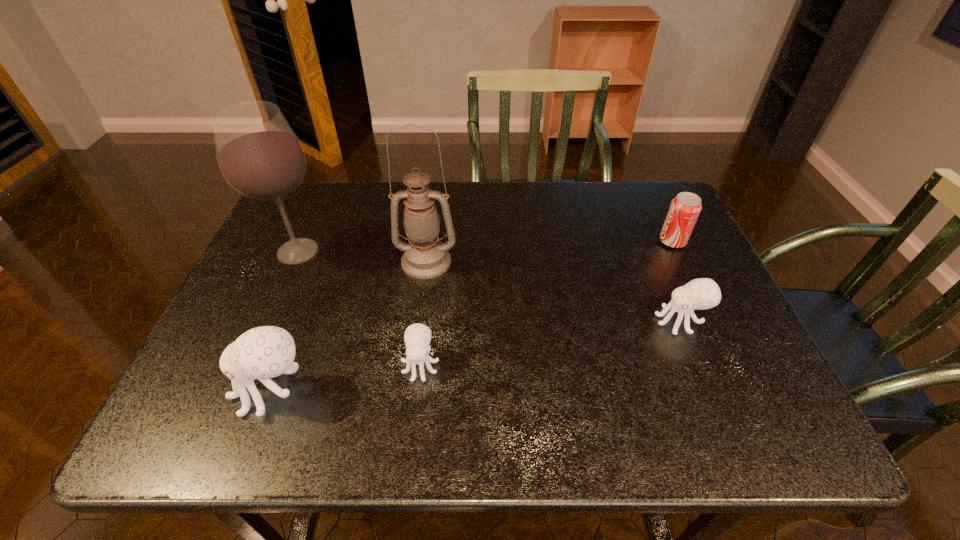
You are a GUI agent. You are given a task and a screenshot of the screen. Output one action in this format:
    pyautogui.click(x=<x>, y=<y>)
    Task: Click on the free space located on the front-facing side of the tallest octopus
    Image resolution: width=960 pixels, height=540 pixels.
    Given the screenshot: What is the action you would take?
    pyautogui.click(x=208, y=390)

Locate an element on the screen. The height and width of the screenshot is (540, 960). vacant space located 0.070m on the front-facing side of the tallest octopus is located at coordinates (198, 390).

In order to click on free space located 0.300m on the front-facing side of the rightmost octopus in this screenshot , I will do (x=525, y=321).

Locate an element on the screen. Image resolution: width=960 pixels, height=540 pixels. vacant space located 0.230m on the front-facing side of the rightmost octopus is located at coordinates (556, 321).

In order to click on free space located 0.160m on the front-facing side of the rightmost octopus in this screenshot , I will do coord(586,321).

This screenshot has width=960, height=540. I want to click on free space located 0.320m on the right of the oil lamp, so click(x=579, y=261).

Where is `vacant region located on the logo side of the soda can`? The width and height of the screenshot is (960, 540). vacant region located on the logo side of the soda can is located at coordinates (604, 241).

Locate an element on the screen. This screenshot has height=540, width=960. vacant space located on the logo side of the soda can is located at coordinates (612, 241).

Where is `free space located 0.100m on the logo side of the soda can`? free space located 0.100m on the logo side of the soda can is located at coordinates tap(622, 241).

In order to click on vacant space located 0.240m on the front of the alcohol in this screenshot , I will do `click(252, 354)`.